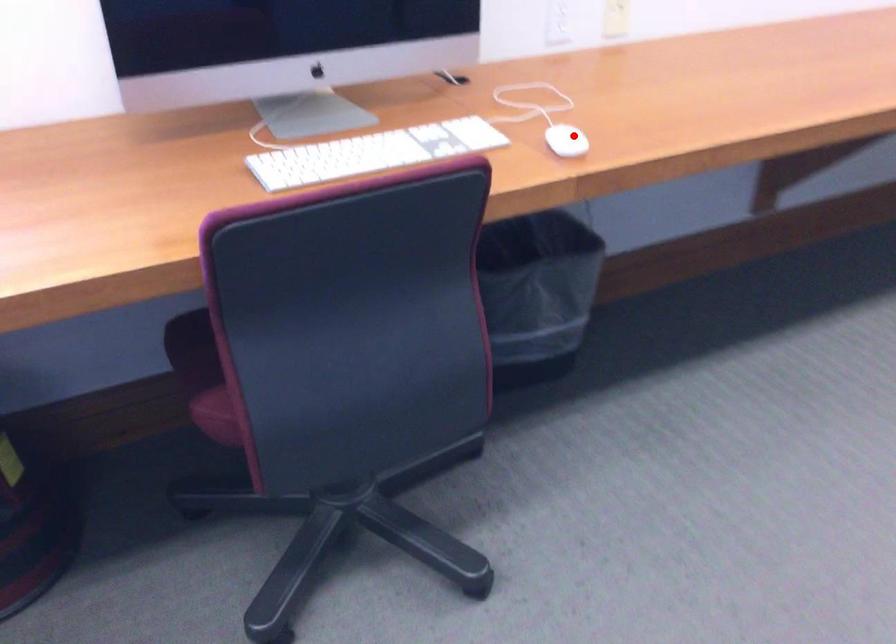
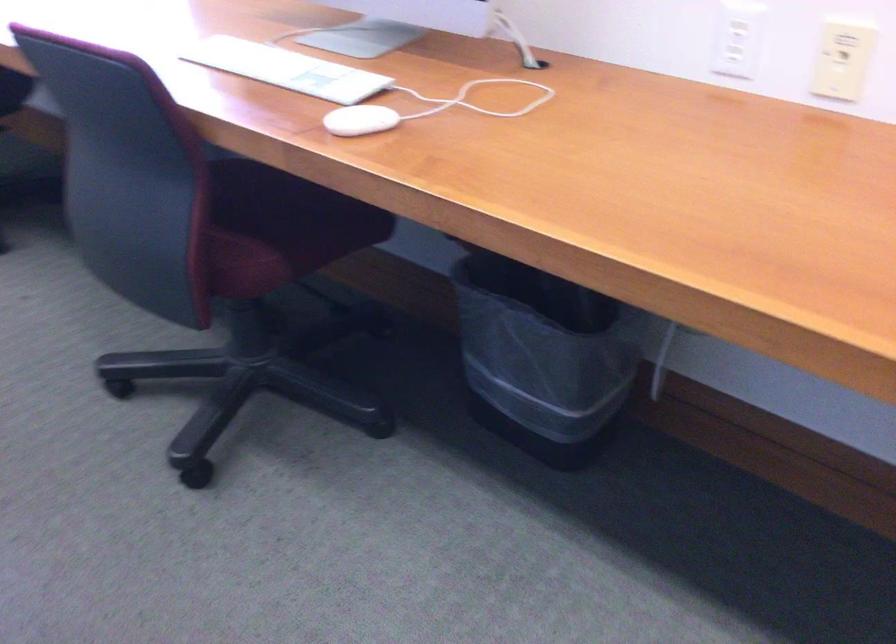
Find the pixel in the second image that matches the highlighted location in the first image.

(359, 120)